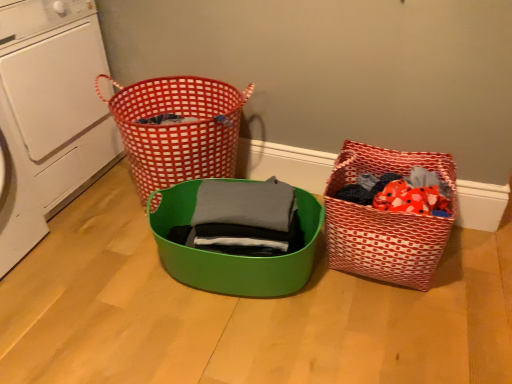
Question: Considering the positions of point (26, 225) and point (236, 279), is point (26, 225) closer or farther from the camera than point (236, 279)?

Choices:
 (A) farther
 (B) closer

Answer: (A)

Question: Relative to matte green bowl at center, placed as the first basket when sorted from left to right, is white plastic washing machine at left in front or behind?

Choices:
 (A) front
 (B) behind

Answer: (B)

Question: Which of these objects is positioned farthest from the red woven fabric basket at lower right, which is the second basket from left to right?

Choices:
 (A) red checkered basket at upper left
 (B) matte green bowl at center, which ranks as the second basket in right-to-left order
 (C) white plastic washing machine at left

Answer: (C)

Question: Based on their relative distances, which object is nearer to the matte green bowl at center, placed as the first basket when sorted from left to right?

Choices:
 (A) red woven fabric basket at lower right, which is the second basket from left to right
 (B) white plastic washing machine at left
 (C) red checkered basket at upper left

Answer: (C)